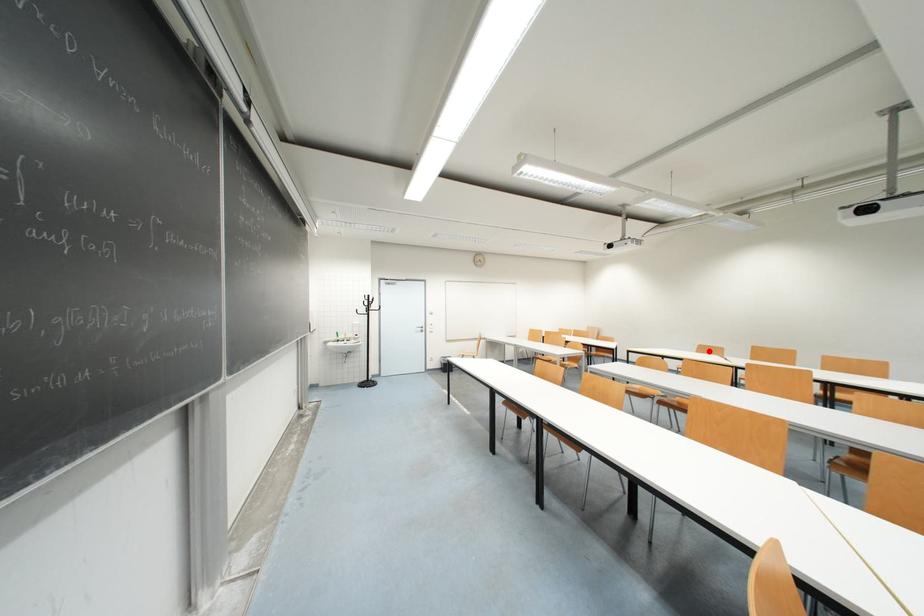
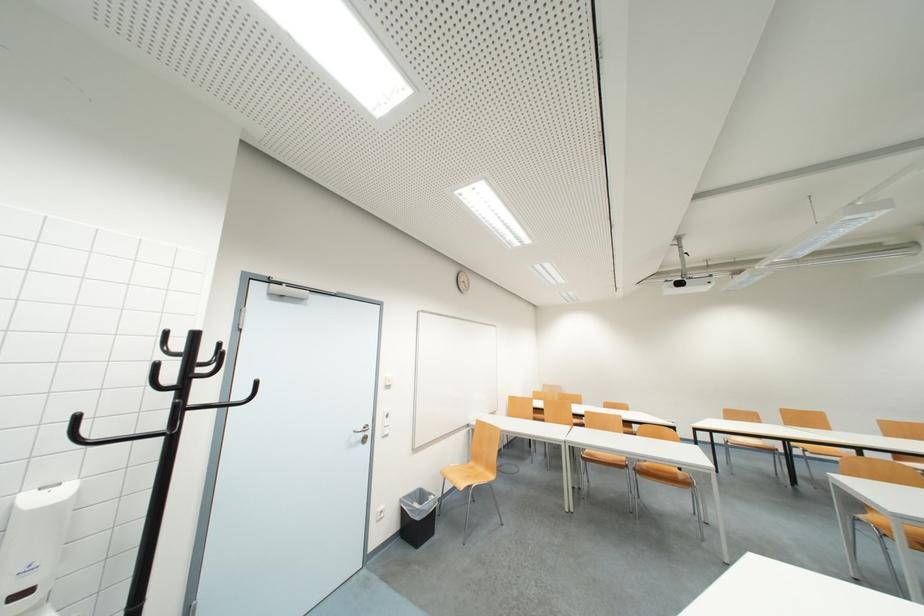
Locate, in the second image, the point that corresponds to the highlighted location in the first image.

(736, 416)